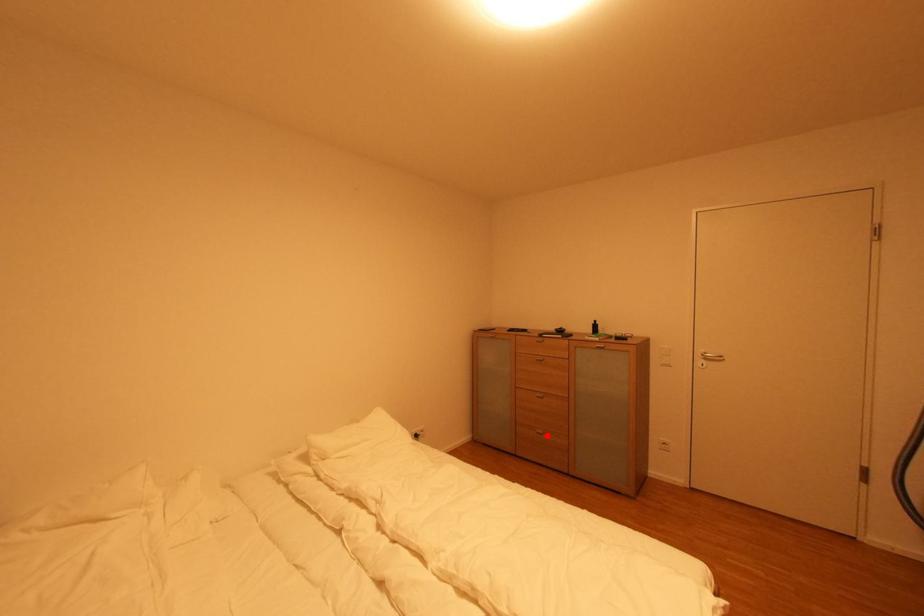
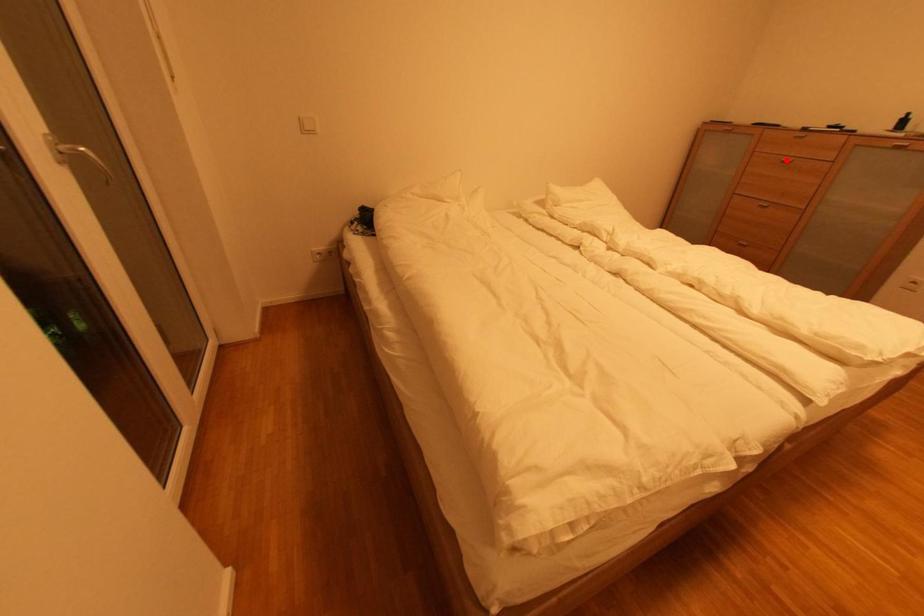
I am providing you with two images of the same scene from different viewpoints. A red point is marked on the first image and another point is marked on the second image. Are the points marked in image1 and image2 representing the same 3D position?

No